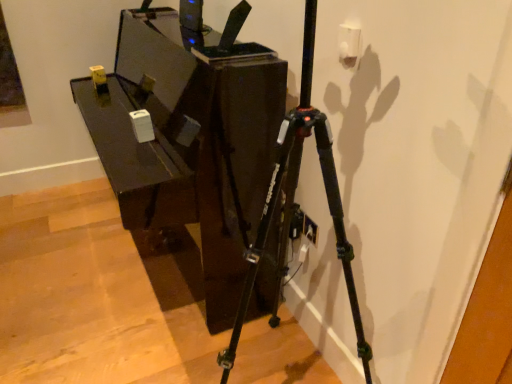
Where is `vacant space underneath glossy dark wood table at center (from a real-world perspective)`? vacant space underneath glossy dark wood table at center (from a real-world perspective) is located at coordinates (146, 270).